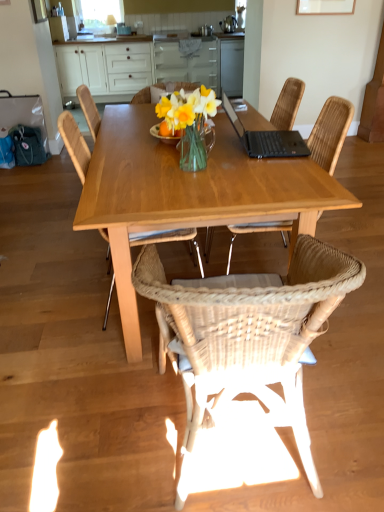
Where is `free point above wooden table at center (from a real-world perspective)`? free point above wooden table at center (from a real-world perspective) is located at coordinates (205, 148).